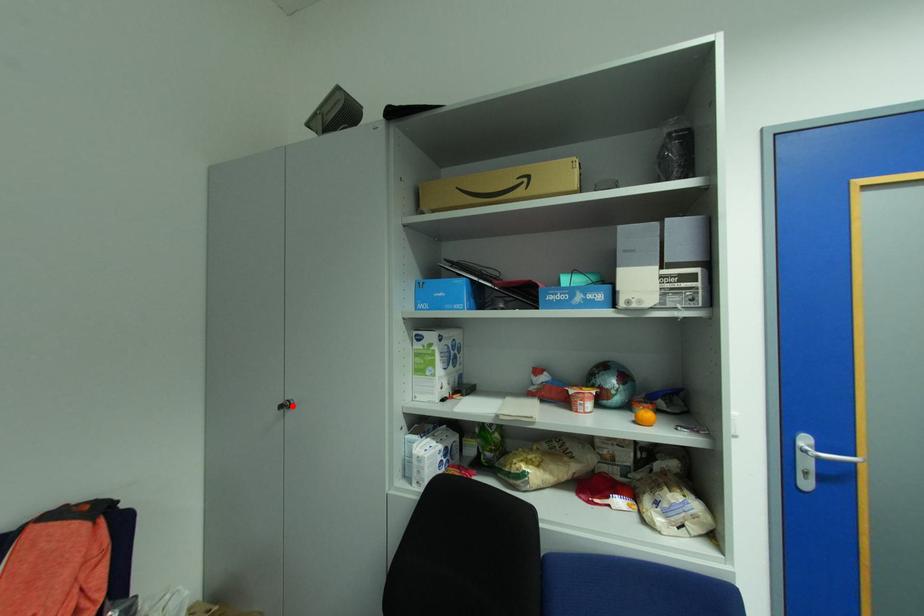
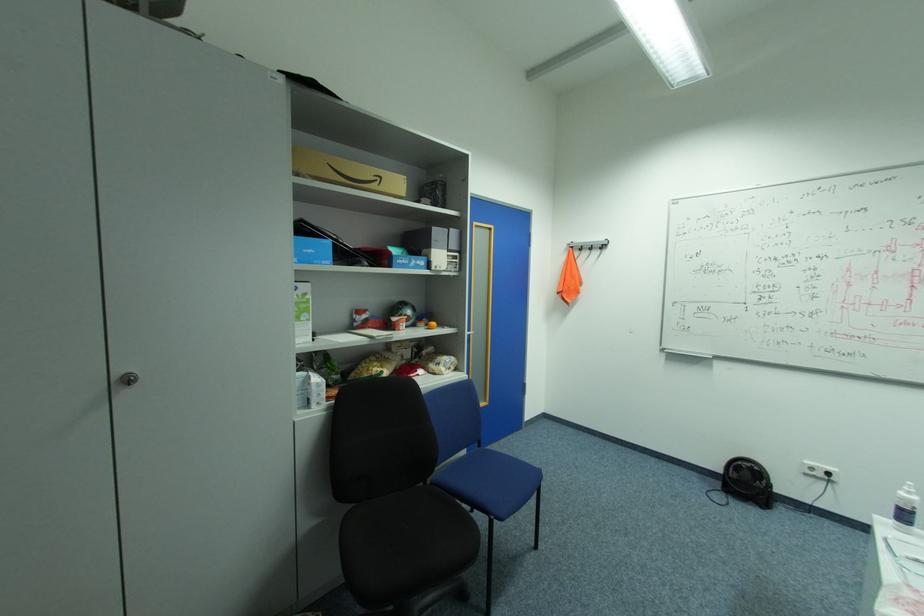
Find the pixel in the second image that matches the highlighted location in the first image.

(137, 379)